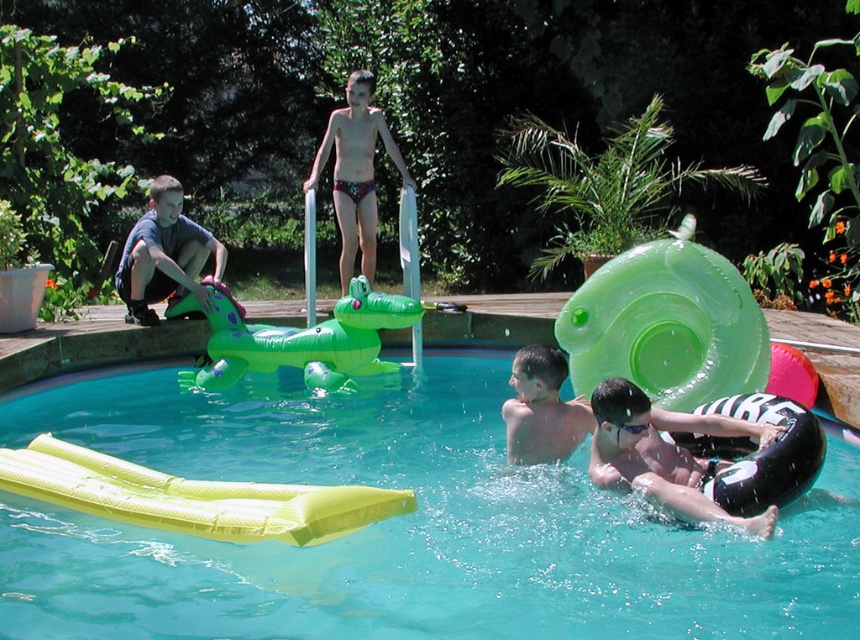
You are standing at the center of the pool and want to reach the black rubber ring at lower right. What direction should you swim to reach it?

You should swim towards the lower right direction to reach the black rubber ring at lower right since it is located at point (664, 454) which is in the lower right quadrant of the image.

You are a parent supervising the pool. You notice the yellow inflatable at lower left and the matte green crocodile at left. Which object is closer to the water surface?

The yellow inflatable at lower left is below the matte green crocodile at left, so the matte green crocodile at left is closer to the water surface.

You are a parent supervising the pool area. You notice the yellow inflatable at lower left and the matte green crocodile at left. Which one is closer to the center of the pool?

The yellow inflatable at lower left is positioned on the right side of matte green crocodile at left, so the yellow inflatable at lower left is closer to the center of the pool.